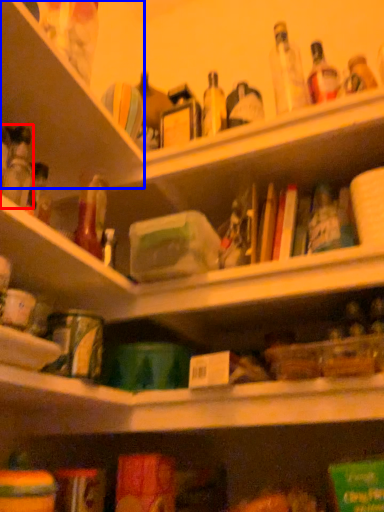
Question: Which of the following is the closest to the observer, bottle (highlighted by a red box) or shelf (highlighted by a blue box)?

Choices:
 (A) bottle
 (B) shelf

Answer: (A)